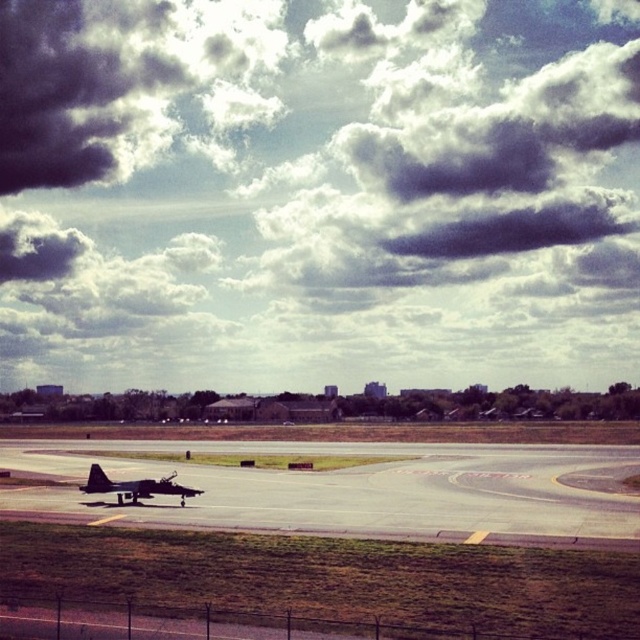
Which of these two, dark gray cloud at upper center or shiny black jet at center, stands shorter?

shiny black jet at center

Image resolution: width=640 pixels, height=640 pixels. Describe the element at coordinates (317, 193) in the screenshot. I see `dark gray cloud at upper center` at that location.

Where is `dark gray cloud at upper center`? dark gray cloud at upper center is located at coordinates (317, 193).

Identify the location of dark gray cloud at upper center. The height and width of the screenshot is (640, 640). (317, 193).

Can you confirm if smooth asphalt runway at lower center is positioned to the left of shiny black jet at center?

Incorrect, smooth asphalt runway at lower center is not on the left side of shiny black jet at center.

Locate an element on the screen. The image size is (640, 640). smooth asphalt runway at lower center is located at coordinates (360, 490).

Locate an element on the screen. The image size is (640, 640). smooth asphalt runway at lower center is located at coordinates (360, 490).

Find the location of a particular element. The height and width of the screenshot is (640, 640). smooth asphalt runway at lower center is located at coordinates (360, 490).